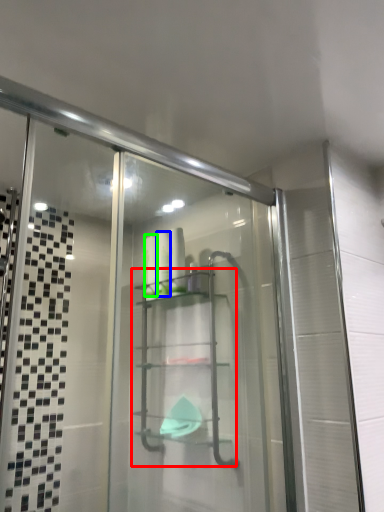
Question: Estimate the real-world distances between objects in this image. Which object is closer to glass box (highlighted by a red box), toiletry (highlighted by a blue box) or toiletry (highlighted by a green box)?

Choices:
 (A) toiletry
 (B) toiletry

Answer: (A)